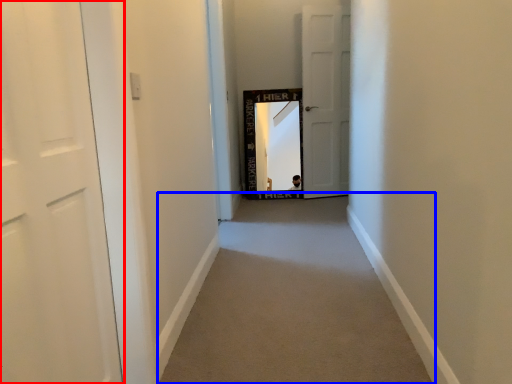
Question: Which object is closer to the camera taking this photo, door (highlighted by a red box) or alley (highlighted by a blue box)?

Choices:
 (A) door
 (B) alley

Answer: (A)